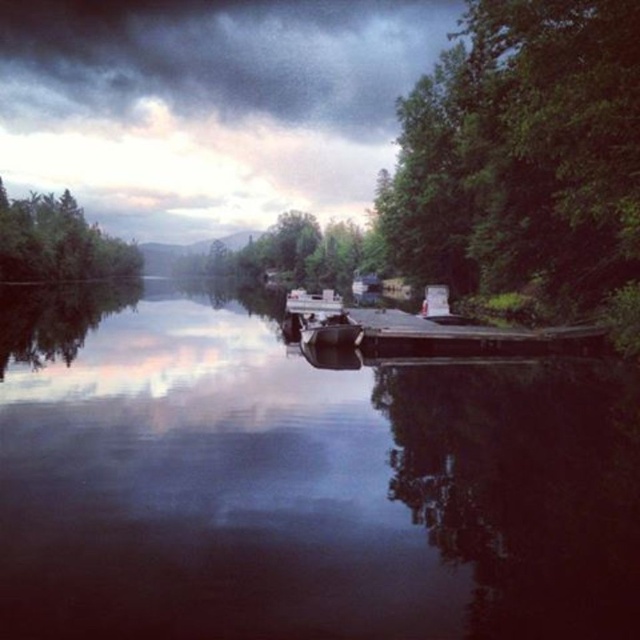
Who is taller, green matte tree at left or smooth wood dock at center?

green matte tree at left

Does green matte tree at left have a lesser width compared to smooth wood dock at center?

In fact, green matte tree at left might be wider than smooth wood dock at center.

Where is `green matte tree at left`? The width and height of the screenshot is (640, 640). green matte tree at left is located at coordinates 58,243.

You are a GUI agent. You are given a task and a screenshot of the screen. Output one action in this format:
    pyautogui.click(x=<x>, y=<y>)
    Task: Click on the green matte tree at left
    
    Given the screenshot: What is the action you would take?
    pyautogui.click(x=58, y=243)

Is green leafy tree at right wider than smooth wood dock at center?

Incorrect, green leafy tree at right's width does not surpass smooth wood dock at center's.

Does green leafy tree at right lie in front of smooth wood dock at center?

Yes, it is.

Is point (536, 241) less distant than point (541, 349)?

No.

Where is `green leafy tree at right`? This screenshot has width=640, height=640. green leafy tree at right is located at coordinates (522, 154).

Between green leafy tree at right and green matte tree at left, which one is positioned lower?

Positioned lower is green leafy tree at right.

Can you confirm if green leafy tree at right is shorter than green matte tree at left?

Indeed, green leafy tree at right has a lesser height compared to green matte tree at left.

Which is behind, point (484, 65) or point (140, 252)?

Point (140, 252)

Locate an element on the screen. This screenshot has width=640, height=640. green leafy tree at right is located at coordinates (522, 154).